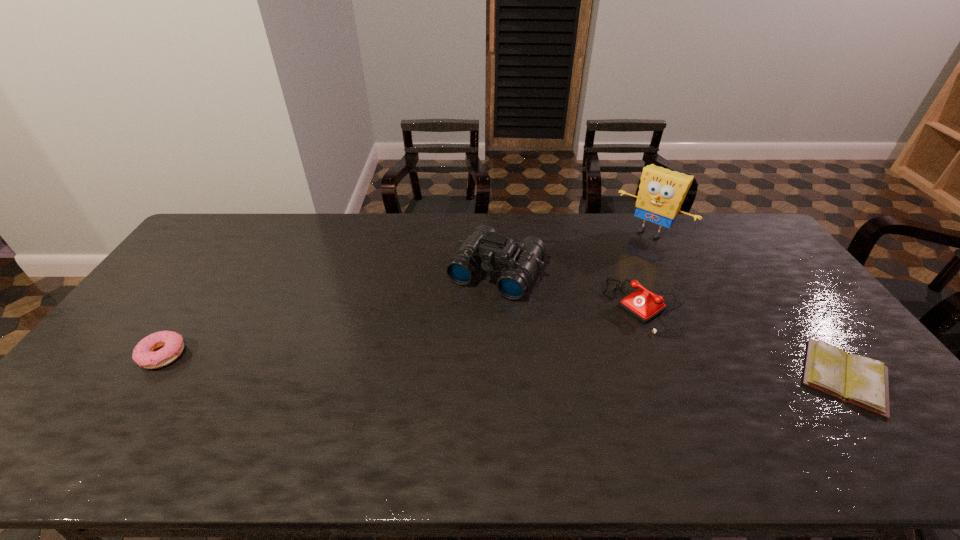
Find the location of `object identified as the second closest to the second shortest object`. object identified as the second closest to the second shortest object is located at coordinates (644, 305).

Where is `the closest object to the shortest object`? the closest object to the shortest object is located at coordinates (644, 305).

Where is `free region that satisfies the following two spatial constraints: 1. on the front side of the diary; 2. on the right side of the tallest object`? This screenshot has height=540, width=960. free region that satisfies the following two spatial constraints: 1. on the front side of the diary; 2. on the right side of the tallest object is located at coordinates (722, 376).

This screenshot has width=960, height=540. Identify the location of vacant point that satisfies the following two spatial constraints: 1. on the back side of the fourth shortest object; 2. on the right side of the leftmost object. (220, 272).

Identify the location of vacant position in the image that satisfies the following two spatial constraints: 1. on the back side of the binoculars; 2. on the right side of the leftmost object. (220, 272).